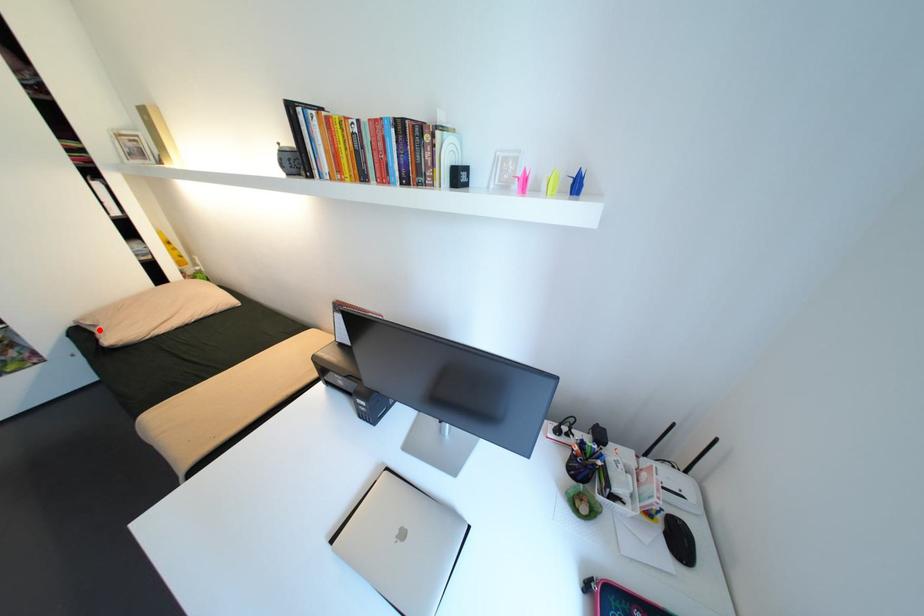
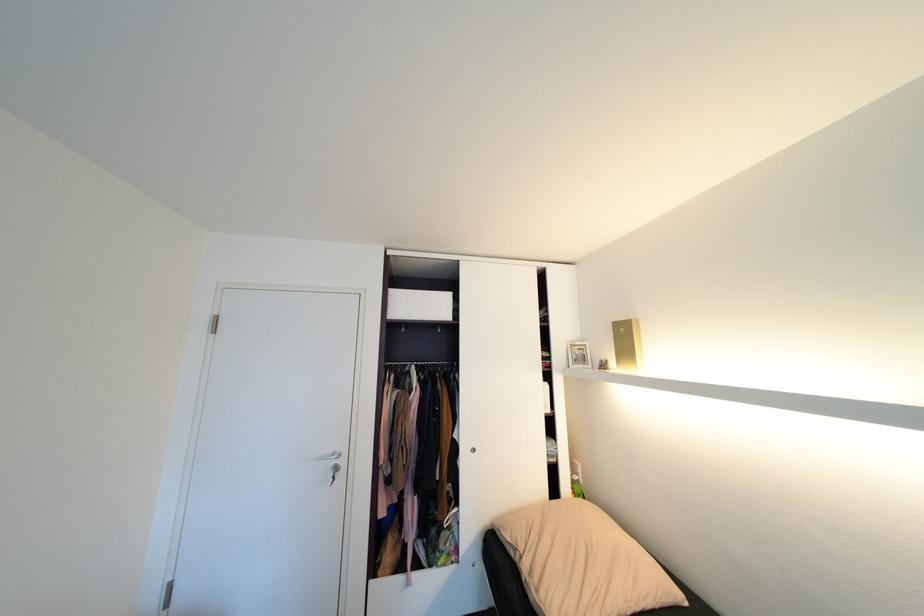
Where in the second image is the point corresponding to the highlighted location from the first image?

(518, 554)